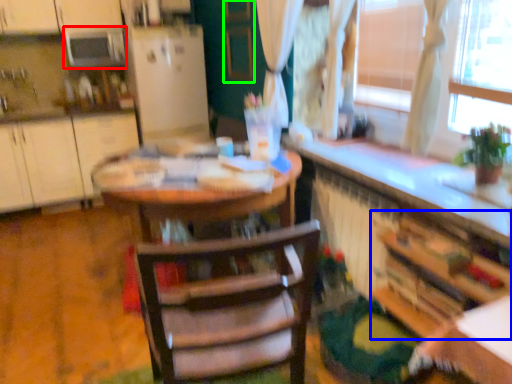
Question: Based on their relative distances, which object is nearer to appliance (highlighted by a red box)? Choose from cabinetry (highlighted by a blue box) and screen door (highlighted by a green box).

Choices:
 (A) cabinetry
 (B) screen door

Answer: (B)